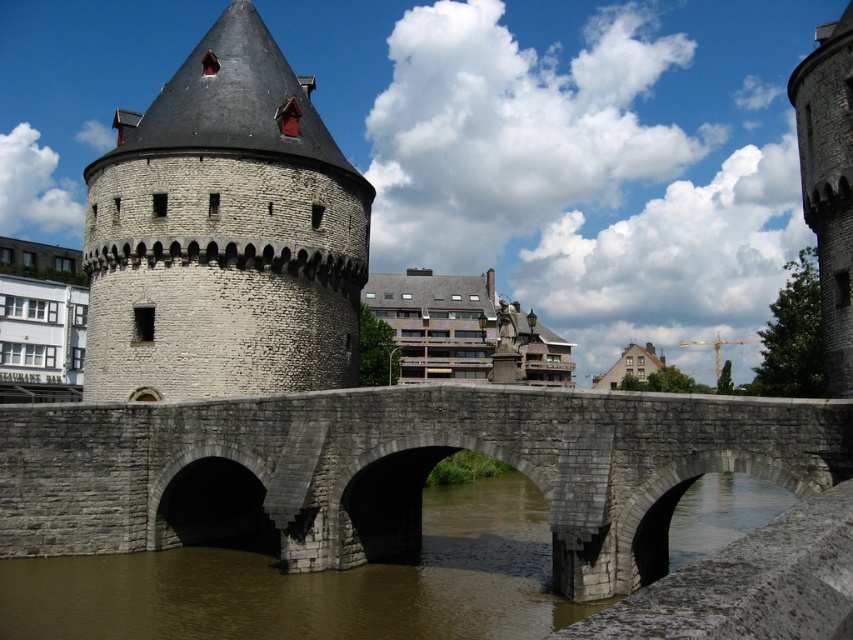
You are standing at a viewpoint overlooking the historic site. The gray stone bridge at center is part of a guided tour route. If the tour requires visitors to stay at least 100 feet away from the bridge for preservation purposes, are you compliant with this rule?

The gray stone bridge at center and the viewer are 107.83 feet apart from each other, which is more than the required 100 feet distance. Therefore, you are compliant with the preservation rule.

You are standing on the historic stone bridge and want to take a photo. There are two points marked in the scene, point 1 at coordinates point [80,541] and point 2 at coordinates point [822,67]. Which point should you focus your camera on to capture the closest object in the scene?

Point [80,541] is closer to the camera than point [822,67], so focusing on point [80,541] will capture the closest object in the scene.